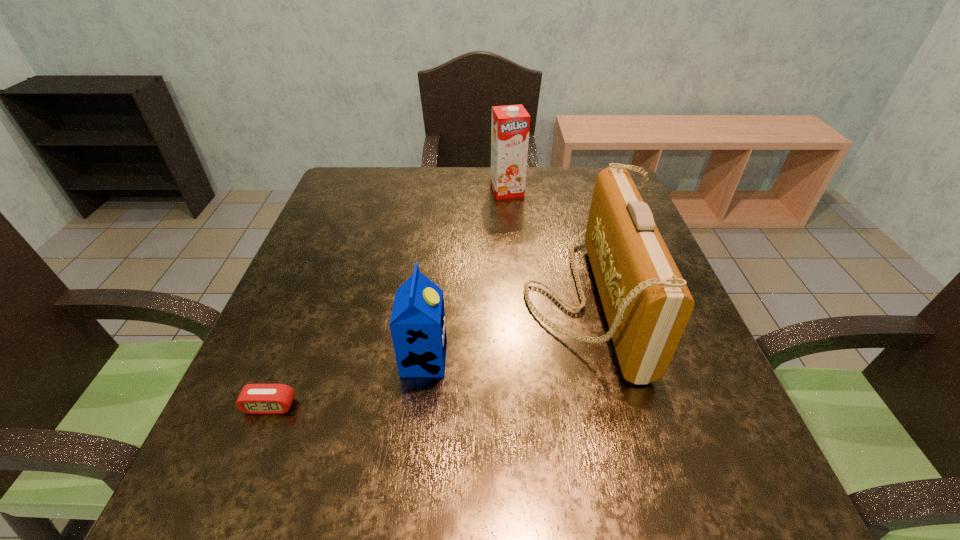
This screenshot has width=960, height=540. Identify the location of the taller carton. (510, 126).

Identify the location of the farther carton. The width and height of the screenshot is (960, 540). (510, 126).

Image resolution: width=960 pixels, height=540 pixels. Identify the location of handbag. (647, 304).

Image resolution: width=960 pixels, height=540 pixels. I want to click on the third object from right to left, so click(x=418, y=329).

The height and width of the screenshot is (540, 960). I want to click on the shorter carton, so click(x=418, y=329).

I want to click on the leftmost object, so click(254, 398).

Identify the location of alarm clock. Image resolution: width=960 pixels, height=540 pixels. (254, 398).

Where is `vacant space located 0.300m on the front of the farther carton`? Image resolution: width=960 pixels, height=540 pixels. vacant space located 0.300m on the front of the farther carton is located at coordinates (514, 269).

Find the location of a particular element. free space located 0.310m on the decorative side of the handbag is located at coordinates (380, 298).

Image resolution: width=960 pixels, height=540 pixels. I want to click on vacant position located 0.390m on the decorative side of the handbag, so click(x=344, y=298).